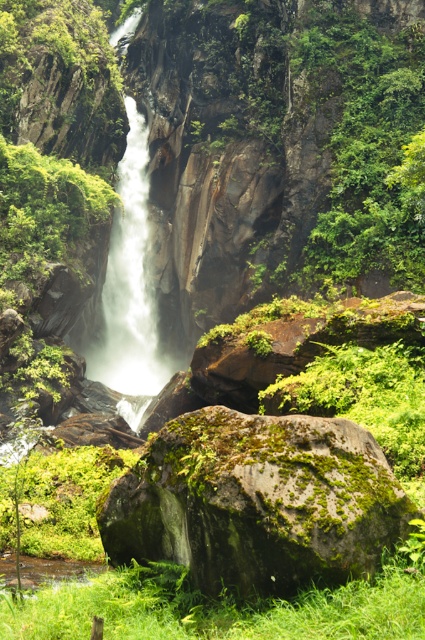
Question: Which point appears closest to the camera in this image?

Choices:
 (A) (127, 355)
 (B) (405, 513)

Answer: (B)

Question: Which point is farther from the camera taking this photo?

Choices:
 (A) (142, 342)
 (B) (334, 541)

Answer: (A)

Question: Which point appears farthest from the camera in this image?

Choices:
 (A) (144, 284)
 (B) (323, 561)

Answer: (A)

Question: Can you confirm if green mossy rock at center is thinner than white frothy water at center?

Choices:
 (A) no
 (B) yes

Answer: (B)

Question: Is green mossy rock at center thinner than white frothy water at center?

Choices:
 (A) yes
 (B) no

Answer: (A)

Question: Does green mossy rock at center appear under white frothy water at center?

Choices:
 (A) no
 (B) yes

Answer: (B)